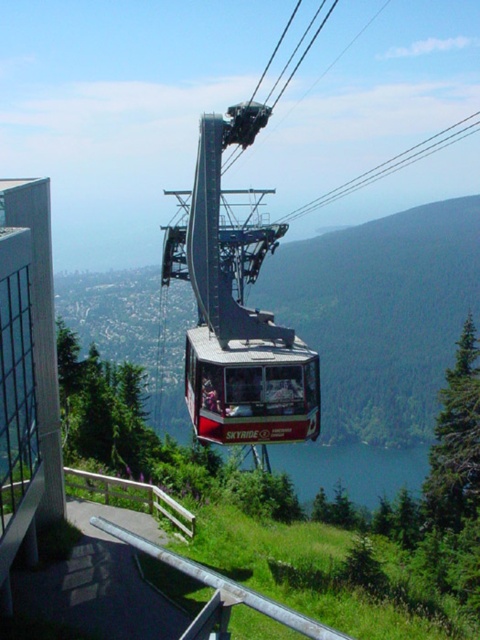
Is red matte cable car at center wider than blue water at lower center?

In fact, red matte cable car at center might be narrower than blue water at lower center.

Does red matte cable car at center have a lesser width compared to blue water at lower center?

Yes, red matte cable car at center is thinner than blue water at lower center.

The width and height of the screenshot is (480, 640). I want to click on red matte cable car at center, so click(x=251, y=388).